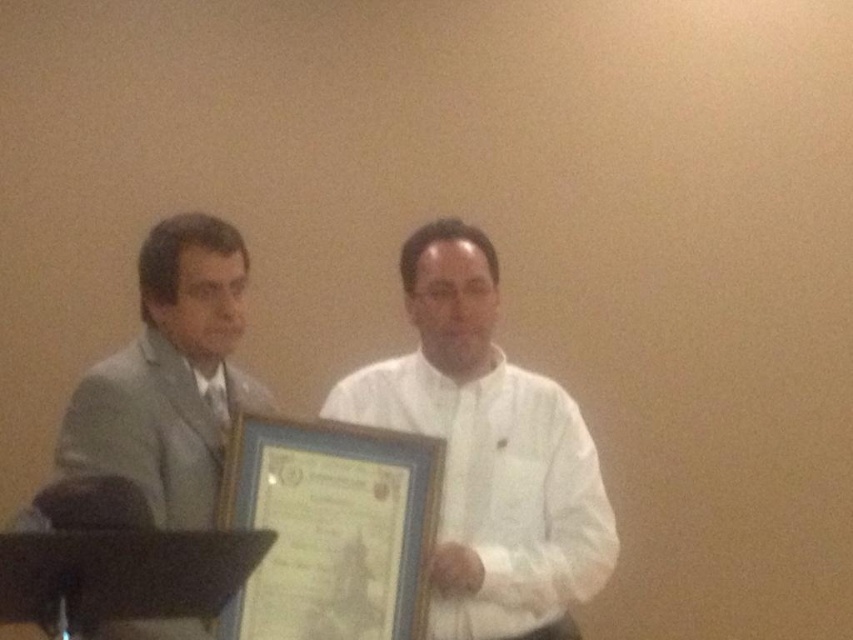
You are organizing a photo shoot and need to position two models based on their clothing. The models are wearing the white matte shirt at center and the light gray suit at left. According to the scene, which model should stand to the right side of the other?

The white matte shirt at center should stand to the right of the light gray suit at left because the white matte shirt at center is to the right of light gray suit at left in the scene.

You are organizing a charity event and need to decide where to place a 1.2 meter tall decorative column. The column must be placed between the white matte shirt at center and the light gray suit at left. Is there enough vertical space between them to accommodate the column?

The white matte shirt at center is below the light gray suit at left, so there is sufficient vertical space between them to place the 1.2 meter tall decorative column.